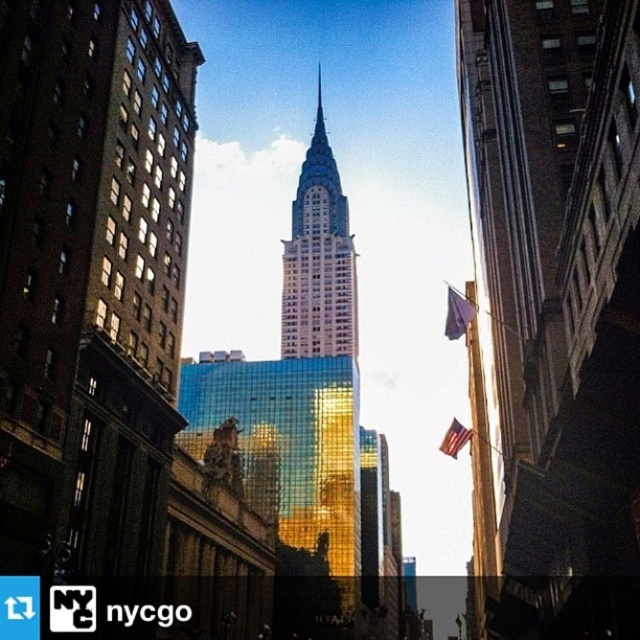
You are a city planner assessing the visibility of the purple fabric flag at upper right from the gold reflective glass skyscraper at center. Given that the two are 242.51 feet apart, would the flag be visible from the top of the skyscraper if the minimum visibility distance required is 200 feet?

The gold reflective glass skyscraper at center and the purple fabric flag at upper right are 242.51 feet apart, which exceeds the minimum visibility distance of 200 feet. Therefore, the flag would be visible from the top of the skyscraper.

Consider the image. You are a photographer standing at the base of the Chrysler Building. You want to capture a photo of the purple fabric flag at upper right. Based on its position, which direction should you look to frame it properly?

The purple fabric flag at upper right is located at point (x=458, y=314), which means it is positioned slightly to the right and upper part of the frame. To frame it properly, you should look upwards and to the right.